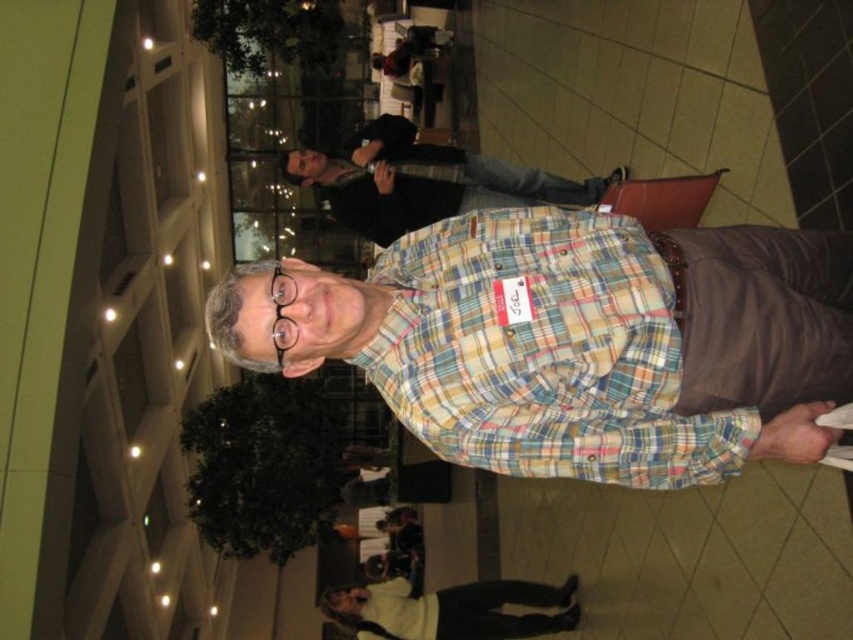
You are at an event and need to decide which item to grab quickly. The multicolored plaid shirt at center and the white fleece sweater at lower center are both within reach. Which one is narrower and easier to grab?

The multicolored plaid shirt at center has a lesser width compared to the white fleece sweater at lower center, so it is narrower and easier to grab.

You are at an event and want to hand a document to Joel, who is wearing the multicolored plaid shirt at center and the white fleece sweater at lower center. Which piece of clothing should you look for to find Joel?

You should look for the multicolored plaid shirt at center because it is closer to the viewer, indicating Joel is in front and easier to locate.